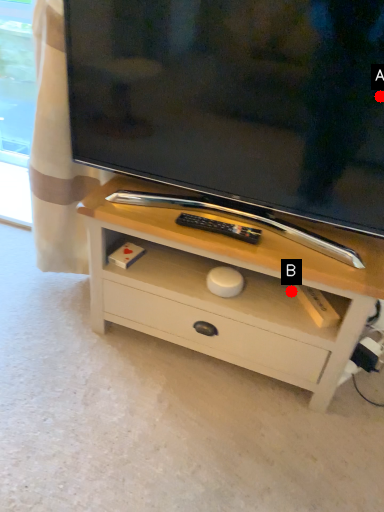
Question: Two points are circled on the image, labeled by A and B beside each circle. Among these points, which one is nearest to the camera?

Choices:
 (A) A is closer
 (B) B is closer

Answer: (A)